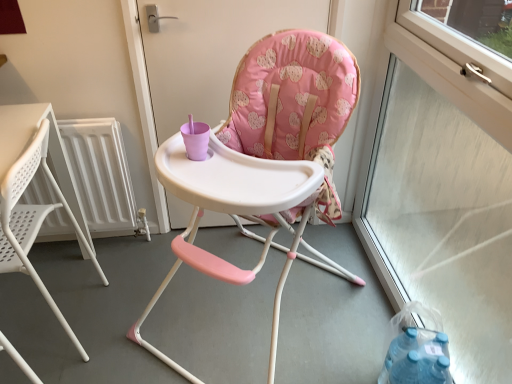
This screenshot has height=384, width=512. I want to click on vacant space in between matte plastic highchair at center, the 2th chair from the left, and white metallic radiator at left, so click(x=133, y=273).